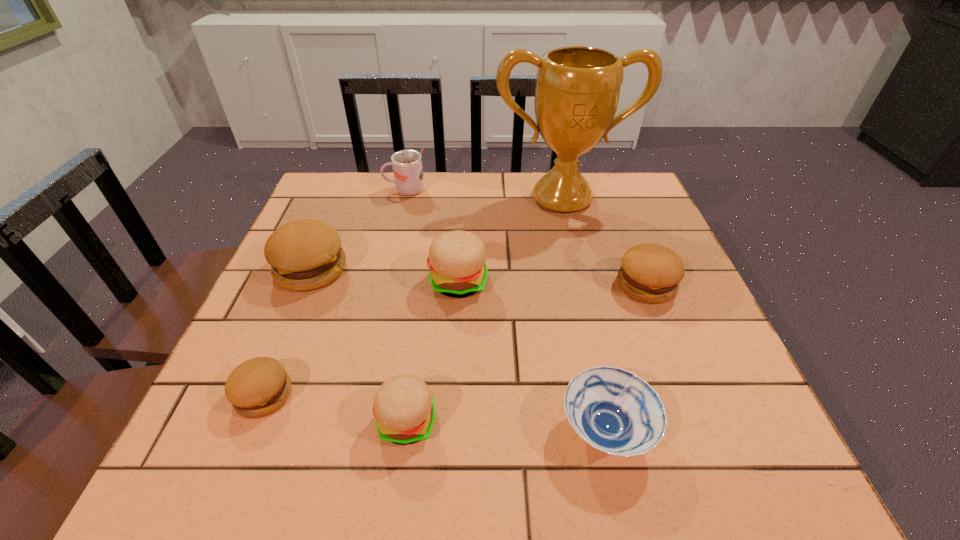
In the image, there is a desktop. In order to click on vacant space at the right edge in this screenshot , I will do `click(746, 389)`.

In the image, there is a desktop. Identify the location of vacant region at the near left corner. (234, 431).

Where is `vacant space in between the bigger beige hamburger and the blue soup bowl`? vacant space in between the bigger beige hamburger and the blue soup bowl is located at coordinates (532, 356).

The image size is (960, 540). I want to click on unoccupied area between the farther beige hamburger and the cup, so click(x=432, y=236).

Where is `vacant area between the nearer beige hamburger and the cup`? The height and width of the screenshot is (540, 960). vacant area between the nearer beige hamburger and the cup is located at coordinates (406, 306).

Locate an element on the screen. empty space that is in between the tallest object and the nearer beige hamburger is located at coordinates (484, 310).

Find the location of a particular element. Image resolution: width=960 pixels, height=540 pixels. vacant point located between the second biggest brown hamburger and the bigger beige hamburger is located at coordinates (553, 283).

Locate an element on the screen. vacant area between the second biggest brown hamburger and the nearest brown hamburger is located at coordinates (455, 340).

What are the coordinates of `free spot between the smaller beige hamburger and the smallest brown hamburger` in the screenshot? It's located at (335, 408).

Where is `empty space between the cup and the rightmost hamburger`? empty space between the cup and the rightmost hamburger is located at coordinates (526, 238).